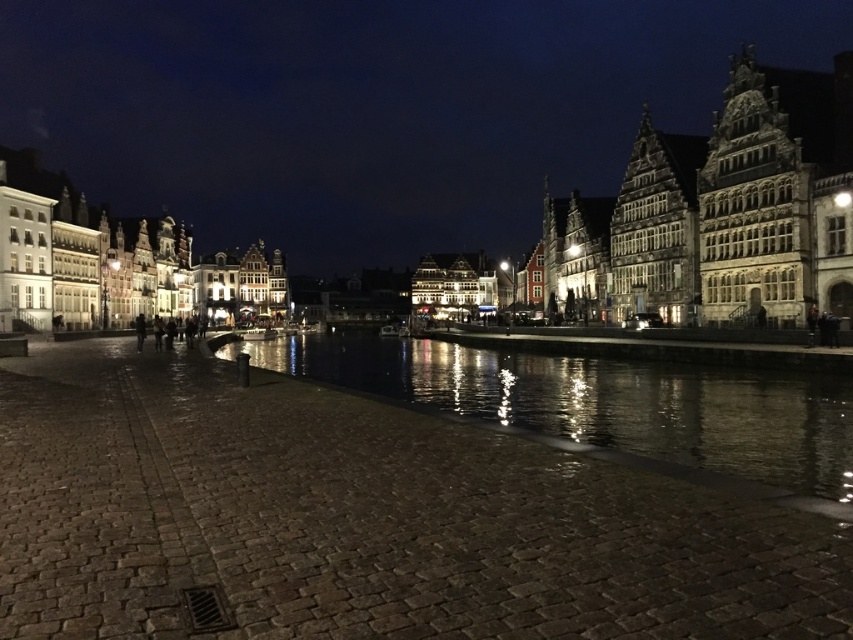
Which is above, stone buildings at center or reflective dark water at center?

Positioned higher is stone buildings at center.

Is point (381, 257) less distant than point (395, 342)?

No, (381, 257) is behind (395, 342).

Locate an element on the screen. stone buildings at center is located at coordinates (372, 108).